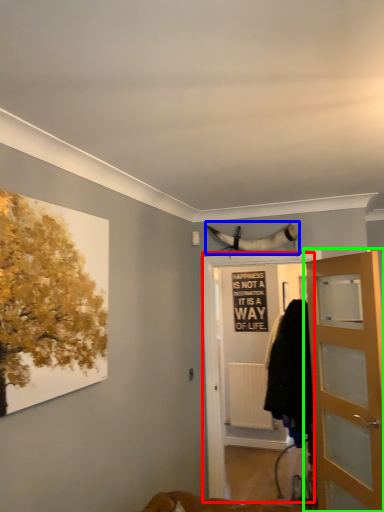
Question: Based on their relative distances, which object is farther from screen door (highlighted by a red box)? Choose from animal (highlighted by a blue box) and door (highlighted by a green box).

Choices:
 (A) animal
 (B) door

Answer: (B)